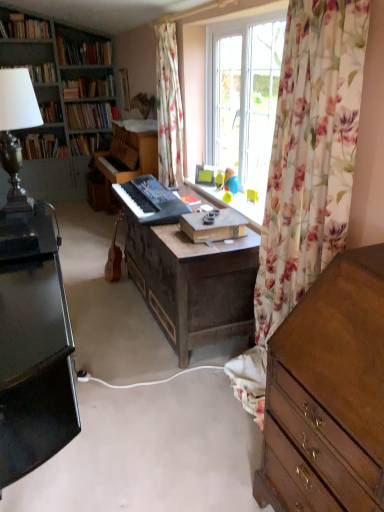
The image size is (384, 512). What are the coordinates of `free location above black matte keyboard at center (from a real-world perspective)` in the screenshot? It's located at (139, 186).